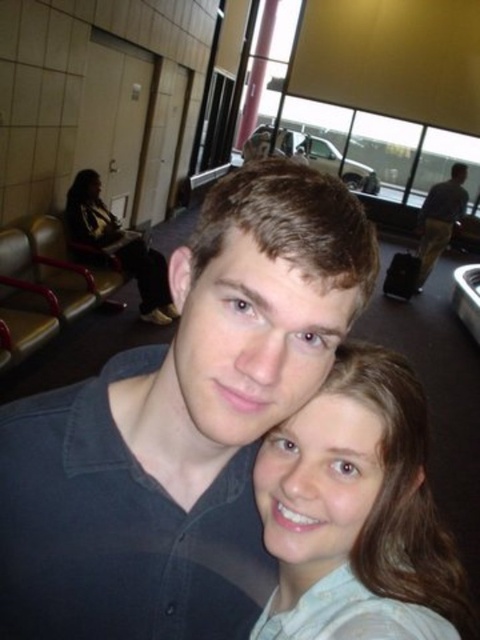
You are a GUI agent. You are given a task and a screenshot of the screen. Output one action in this format:
    pyautogui.click(x=<x>, y=<y>)
    Task: Click on the matte black jacket at left
    
    Given the screenshot: What is the action you would take?
    pyautogui.click(x=116, y=246)

Image resolution: width=480 pixels, height=640 pixels. In order to click on matte black jacket at left in this screenshot , I will do 116,246.

Can you confirm if smooth beige shirt at center is positioned to the right of matte black jacket at left?

Yes, smooth beige shirt at center is to the right of matte black jacket at left.

Between smooth beige shirt at center and matte black jacket at left, which one is positioned lower?

smooth beige shirt at center

Who is more distant from viewer, (386,598) or (84,225)?

Positioned behind is point (84,225).

At what (x,y) coordinates should I click in order to perform the action: click on smooth beige shirt at center. Please return your answer as a coordinate pair (x, y). Looking at the image, I should click on (357, 512).

Is point (286, 566) in front of point (439, 216)?

That is True.

Can you confirm if smooth beige shirt at center is positioned to the left of dark blue shirt at right?

Yes, smooth beige shirt at center is to the left of dark blue shirt at right.

Is point (396, 508) less distant than point (460, 166)?

Yes, it is in front of point (460, 166).

The image size is (480, 640). Identify the location of smooth beige shirt at center. (357, 512).